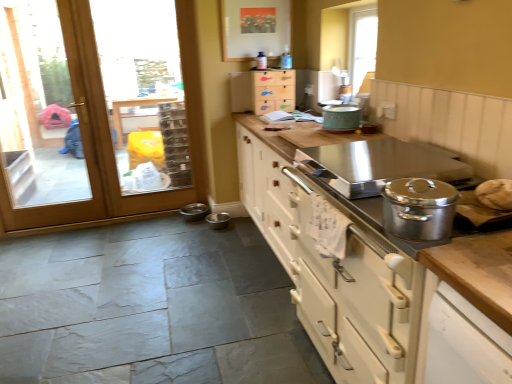
Question: Is metallic stainless steel bowl at lower center, arranged as the 2th appliance when viewed from the left, wider than metallic stainless steel bowls at lower center, the second appliance in the right-to-left sequence?

Choices:
 (A) yes
 (B) no

Answer: (B)

Question: Considering the relative positions of metallic stainless steel bowl at lower center, arranged as the 2th appliance when viewed from the left, and metallic stainless steel bowls at lower center, the second appliance in the right-to-left sequence, in the image provided, is metallic stainless steel bowl at lower center, arranged as the 2th appliance when viewed from the left, to the right of metallic stainless steel bowls at lower center, the second appliance in the right-to-left sequence, from the viewer's perspective?

Choices:
 (A) yes
 (B) no

Answer: (A)

Question: Is metallic stainless steel bowl at lower center, the first appliance viewed from the right, not close to metallic stainless steel bowls at lower center, the 1th appliance in the left-to-right sequence?

Choices:
 (A) yes
 (B) no

Answer: (B)

Question: Is metallic stainless steel bowl at lower center, the first appliance viewed from the right, further to camera compared to metallic stainless steel bowls at lower center, the second appliance in the right-to-left sequence?

Choices:
 (A) no
 (B) yes

Answer: (A)

Question: Can you confirm if metallic stainless steel bowl at lower center, the first appliance viewed from the right, is shorter than metallic stainless steel bowls at lower center, the 1th appliance in the left-to-right sequence?

Choices:
 (A) yes
 (B) no

Answer: (A)

Question: Is metallic stainless steel bowls at lower center, the second appliance in the right-to-left sequence, wider or thinner than metallic stainless steel bowl at lower center, the first appliance viewed from the right?

Choices:
 (A) thin
 (B) wide

Answer: (B)

Question: Does point click(x=184, y=218) appear closer or farther from the camera than point click(x=220, y=211)?

Choices:
 (A) closer
 (B) farther

Answer: (B)

Question: From the image's perspective, is metallic stainless steel bowls at lower center, the second appliance in the right-to-left sequence, above or below metallic stainless steel bowl at lower center, arranged as the 2th appliance when viewed from the left?

Choices:
 (A) above
 (B) below

Answer: (A)

Question: Is metallic stainless steel bowls at lower center, the second appliance in the right-to-left sequence, taller or shorter than metallic stainless steel bowl at lower center, arranged as the 2th appliance when viewed from the left?

Choices:
 (A) tall
 (B) short

Answer: (A)

Question: Visually, is wooden fish drawer at upper center, which is the 1th cabinetry from back to front, positioned to the left or to the right of metallic stainless steel bowls at lower center, the 1th appliance in the left-to-right sequence?

Choices:
 (A) left
 (B) right

Answer: (B)

Question: From the image's perspective, is wooden fish drawer at upper center, arranged as the 2th cabinetry when ordered from the bottom, positioned above or below metallic stainless steel bowls at lower center, the 1th appliance in the left-to-right sequence?

Choices:
 (A) above
 (B) below

Answer: (A)

Question: Considering their positions, is wooden fish drawer at upper center, which ranks as the second cabinetry in front-to-back order, located in front of or behind metallic stainless steel bowls at lower center, the 1th appliance in the left-to-right sequence?

Choices:
 (A) behind
 (B) front

Answer: (B)

Question: From a real-world perspective, relative to metallic stainless steel bowls at lower center, the 1th appliance in the left-to-right sequence, is wooden fish drawer at upper center, which ranks as the second cabinetry in front-to-back order, vertically above or below?

Choices:
 (A) above
 (B) below

Answer: (A)

Question: Is teal matte pot at upper center to the left or to the right of metallic stainless steel bowls at lower center, the second appliance in the right-to-left sequence, in the image?

Choices:
 (A) left
 (B) right

Answer: (B)

Question: Considering the positions of teal matte pot at upper center and metallic stainless steel bowls at lower center, the second appliance in the right-to-left sequence, in the image, is teal matte pot at upper center wider or thinner than metallic stainless steel bowls at lower center, the second appliance in the right-to-left sequence,?

Choices:
 (A) thin
 (B) wide

Answer: (B)